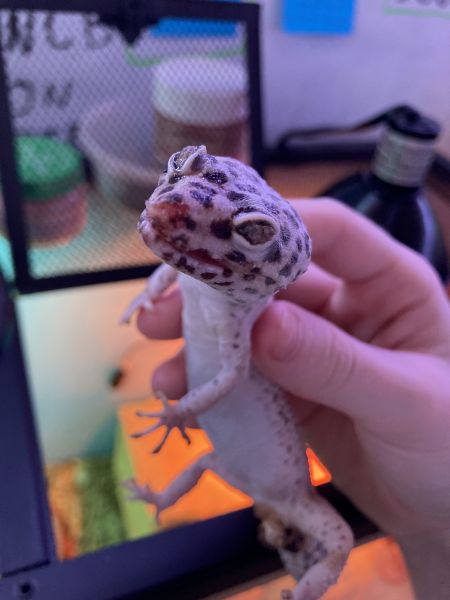
At what (x,y) coordinates should I click in order to perform the action: click on bottle lid. Please return your answer as a coordinate pair (x, y). The width and height of the screenshot is (450, 600). Looking at the image, I should click on (405, 156).